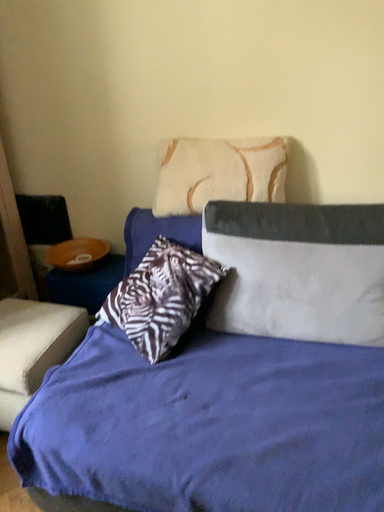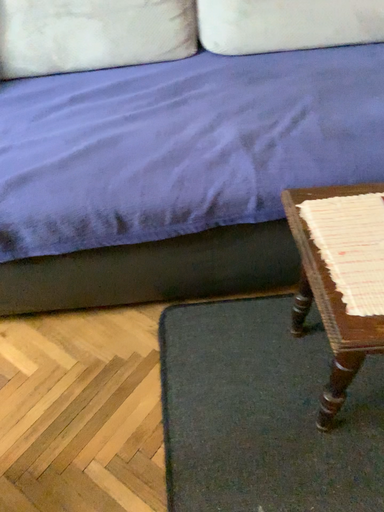
Question: How did the camera likely rotate when shooting the video?

Choices:
 (A) rotated left
 (B) rotated right

Answer: (B)